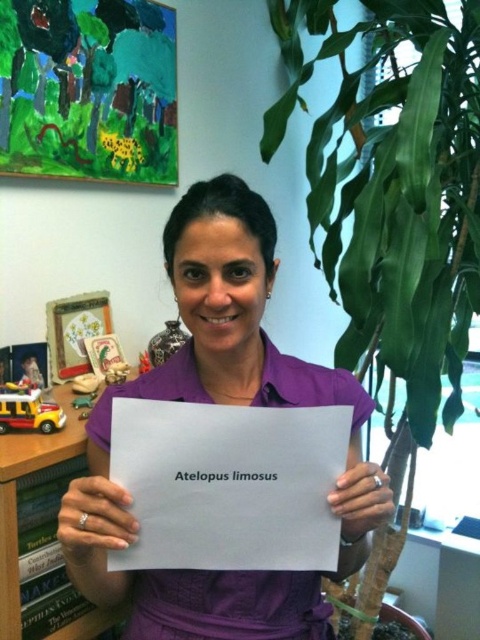
Question: Does green leafy plant at center appear on the left side of wooden bookshelf at lower left?

Choices:
 (A) no
 (B) yes

Answer: (A)

Question: Can you confirm if green leafy plant at center is positioned to the right of purple fabric shirt at center?

Choices:
 (A) yes
 (B) no

Answer: (A)

Question: Does purple fabric shirt at center come behind wooden bookshelf at lower left?

Choices:
 (A) yes
 (B) no

Answer: (B)

Question: Which of the following is the farthest from the observer?

Choices:
 (A) white paper at center
 (B) wooden bookshelf at lower left
 (C) green leafy plant at center

Answer: (C)

Question: Which is farther from the wooden bookshelf at lower left?

Choices:
 (A) green leafy plant at center
 (B) white paper at center
 (C) purple fabric shirt at center

Answer: (A)

Question: Which object is closer to the camera taking this photo?

Choices:
 (A) wooden bookshelf at lower left
 (B) green leafy plant at center

Answer: (A)